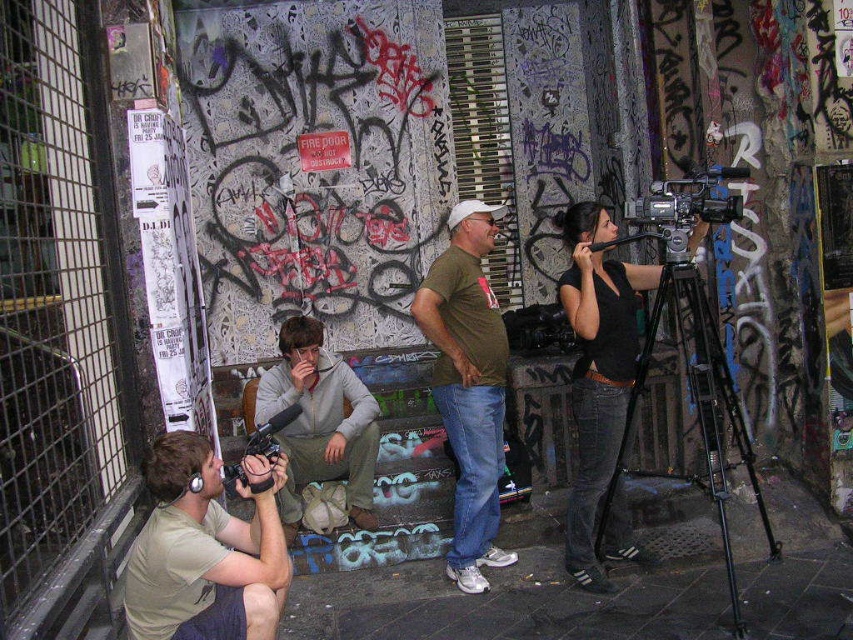
Question: Does green cotton t-shirt at center have a smaller size compared to black matte camera at right?

Choices:
 (A) no
 (B) yes

Answer: (B)

Question: Observing the image, what is the correct spatial positioning of green cotton t-shirt at center in reference to black plastic video camera at upper right?

Choices:
 (A) below
 (B) above

Answer: (A)

Question: Estimate the real-world distances between objects in this image. Which object is closer to the green cotton t-shirt at center?

Choices:
 (A) black metal tripod at center right
 (B) matte black video camera at lower left

Answer: (A)

Question: Which point is closer to the camera?

Choices:
 (A) black metal tripod at center right
 (B) black plastic video camera at upper right

Answer: (A)

Question: Is black plastic video camera at upper right smaller than matte black video camera at lower left?

Choices:
 (A) no
 (B) yes

Answer: (A)

Question: Which point appears closest to the camera in this image?

Choices:
 (A) (608, 461)
 (B) (672, 179)
 (C) (486, 211)

Answer: (A)